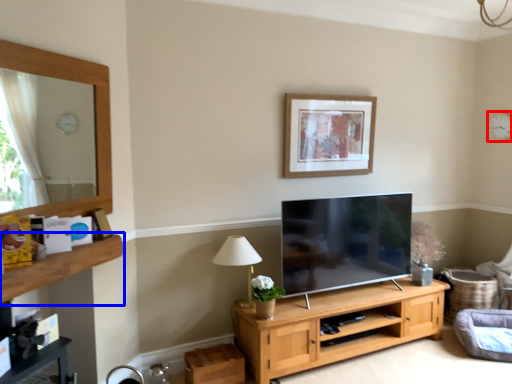
Question: Which object appears farthest to the camera in this image, clock (highlighted by a red box) or shelf (highlighted by a blue box)?

Choices:
 (A) clock
 (B) shelf

Answer: (A)